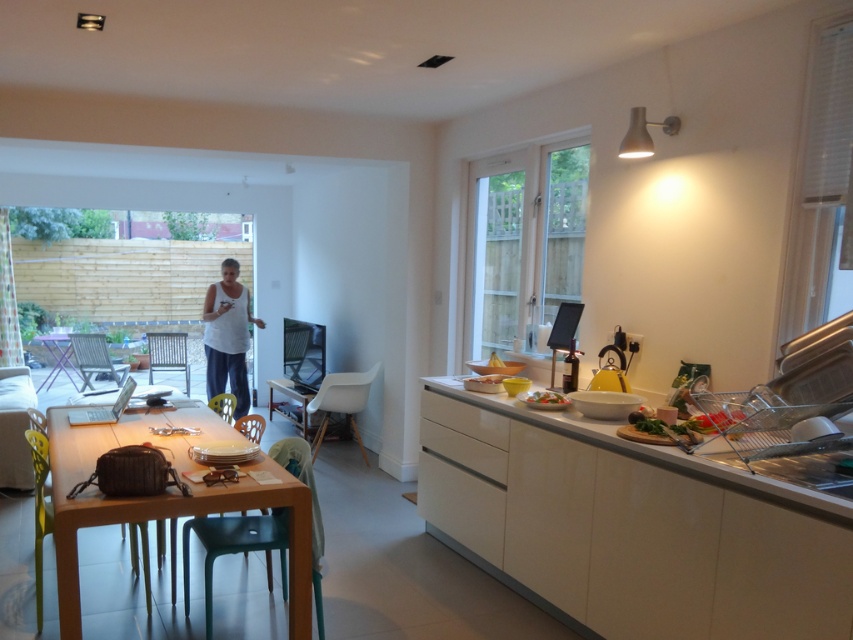
Question: Does white glossy counter top at right appear on the right side of white cotton shirt at center?

Choices:
 (A) yes
 (B) no

Answer: (A)

Question: Which object appears farthest from the camera in this image?

Choices:
 (A) transparent plastic glass door at upper right
 (B) white glossy counter top at right
 (C) matte white plate at center
 (D) white cotton shirt at center

Answer: (D)

Question: Where is white glossy counter top at right located in relation to wooden table at center in the image?

Choices:
 (A) right
 (B) left

Answer: (A)

Question: Is transparent plastic glass door at upper right to the right of matte white plate at center from the viewer's perspective?

Choices:
 (A) no
 (B) yes

Answer: (A)

Question: Which point is closer to the camera?

Choices:
 (A) transparent plastic glass door at upper right
 (B) white glossy counter top at right
 (C) matte white plate at center
 (D) wooden table at center

Answer: (B)

Question: Which point is farther to the camera?

Choices:
 (A) (223, 280)
 (B) (85, 468)

Answer: (A)